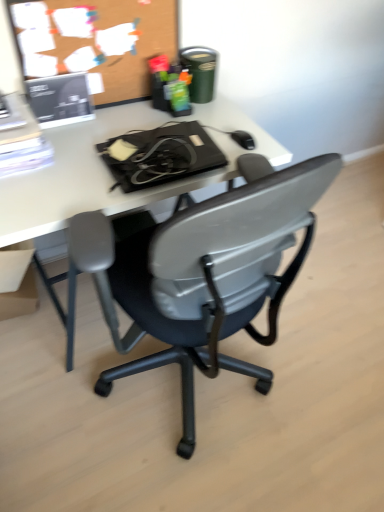
This screenshot has width=384, height=512. What are the coordinates of `vacant area that lies in front of matte cardboard box at lower left` in the screenshot? It's located at (27, 340).